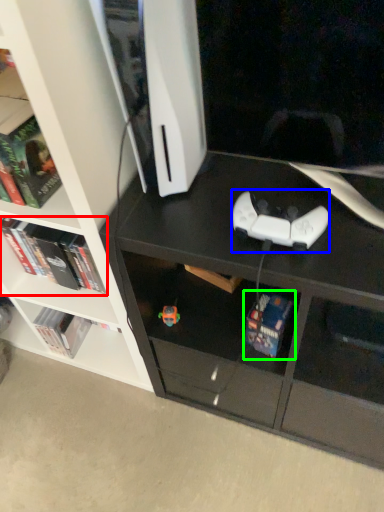
Question: Which object is positioned farthest from book (highlighted by a red box)? Select from game controller (highlighted by a blue box) and book (highlighted by a green box).

Choices:
 (A) game controller
 (B) book

Answer: (A)